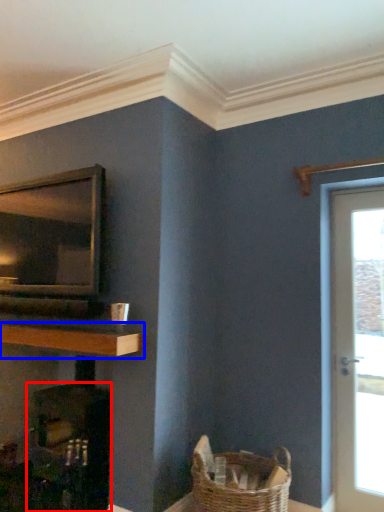
Question: Which of the following is the farthest to the observer, fireplace (highlighted by a red box) or shelf (highlighted by a blue box)?

Choices:
 (A) fireplace
 (B) shelf

Answer: (A)